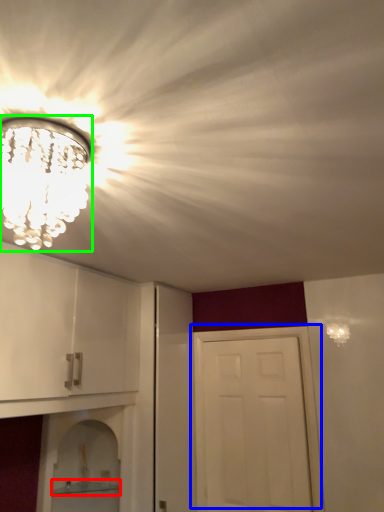
Question: Considering the real-world distances, which object is farthest from shelf (highlighted by a red box)? door (highlighted by a blue box) or light fixture (highlighted by a green box)?

Choices:
 (A) door
 (B) light fixture

Answer: (B)